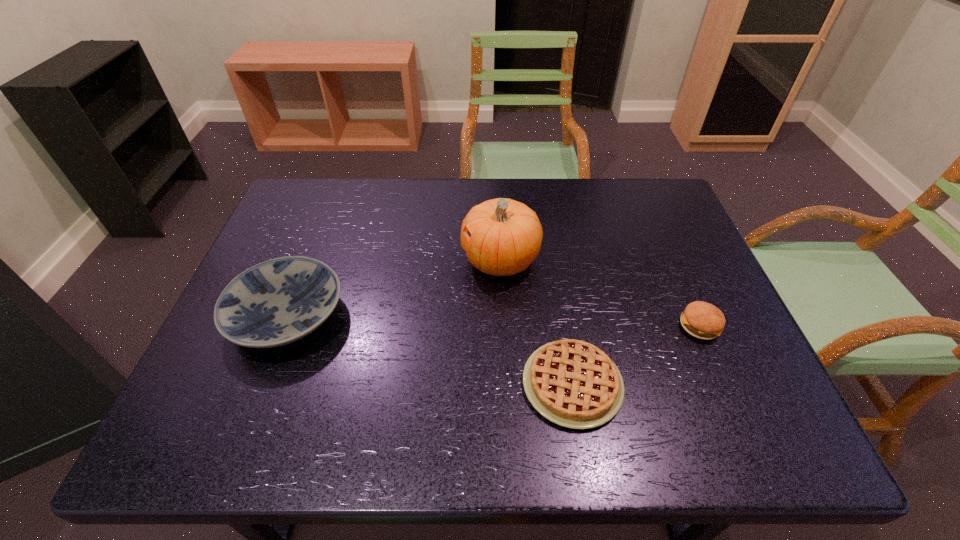
Where is `vacant space positioned on the left of the hamburger`? vacant space positioned on the left of the hamburger is located at coordinates (555, 326).

What are the coordinates of `vacant space located 0.220m on the left of the pie` in the screenshot? It's located at (x=418, y=384).

Find the location of a particular element. object that is at the near edge is located at coordinates (572, 383).

Locate an element on the screen. This screenshot has height=540, width=960. object that is positioned at the left edge is located at coordinates (274, 303).

This screenshot has width=960, height=540. Find the location of `object located at the right edge`. object located at the right edge is located at coordinates (702, 320).

I want to click on vacant space at the far edge of the desktop, so click(540, 199).

The width and height of the screenshot is (960, 540). What are the coordinates of `free region at the left edge of the desktop` in the screenshot? It's located at (241, 406).

Identify the location of vacant space at the right edge of the desktop. Image resolution: width=960 pixels, height=540 pixels. (664, 284).

Identify the location of vacant space at the far left corner of the desktop. (332, 188).

In the image, there is a desktop. Identify the location of vacant area at the far right corner. (627, 223).